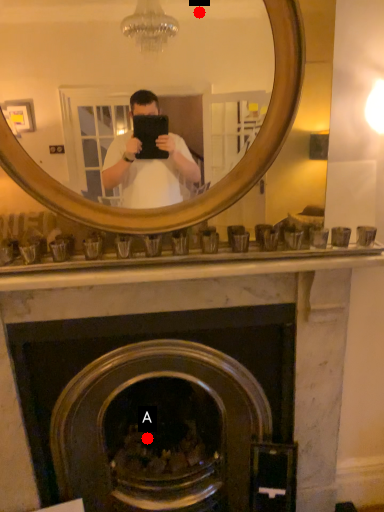
Question: Two points are circled on the image, labeled by A and B beside each circle. Which point appears farthest from the camera in this image?

Choices:
 (A) A is further
 (B) B is further

Answer: (B)